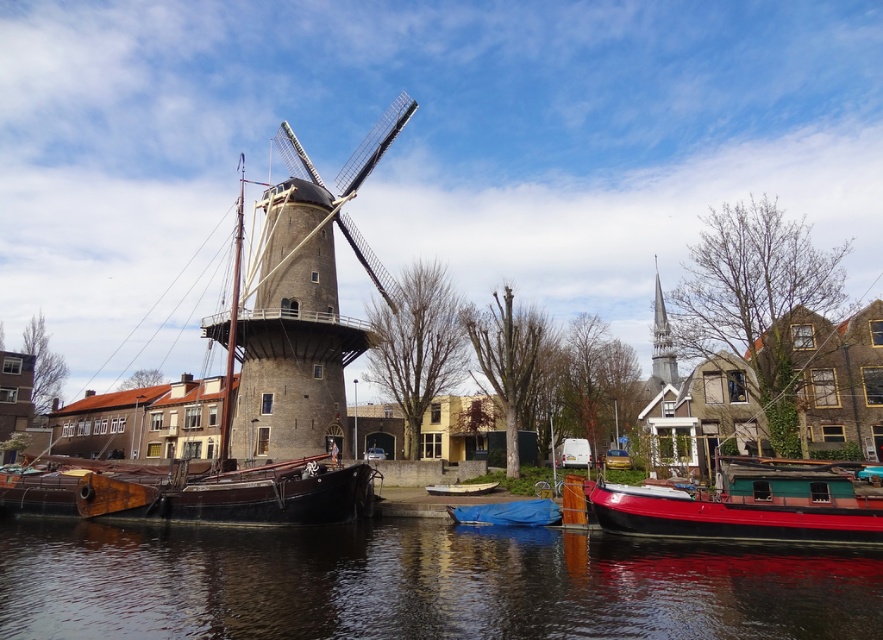
Question: Does smooth water at lower center appear over blue tarpaulin boat at center?

Choices:
 (A) no
 (B) yes

Answer: (A)

Question: Among these objects, which one is farthest from the camera?

Choices:
 (A) white matte boat at center
 (B) smooth water at lower center
 (C) blue tarpaulin boat at center
 (D) shiny red boat at lower right

Answer: (A)

Question: Does shiny red boat at lower right have a lesser width compared to white matte boat at center?

Choices:
 (A) yes
 (B) no

Answer: (B)

Question: Considering the real-world distances, which object is farthest from the white matte boat at center?

Choices:
 (A) shiny red boat at lower right
 (B) smooth water at lower center
 (C) blue tarpaulin boat at center

Answer: (A)

Question: Can you confirm if blue tarpaulin boat at center is smaller than white matte boat at center?

Choices:
 (A) no
 (B) yes

Answer: (A)

Question: Which object appears closest to the camera in this image?

Choices:
 (A) blue tarpaulin boat at center
 (B) white matte boat at center
 (C) smooth water at lower center
 (D) shiny red boat at lower right

Answer: (C)